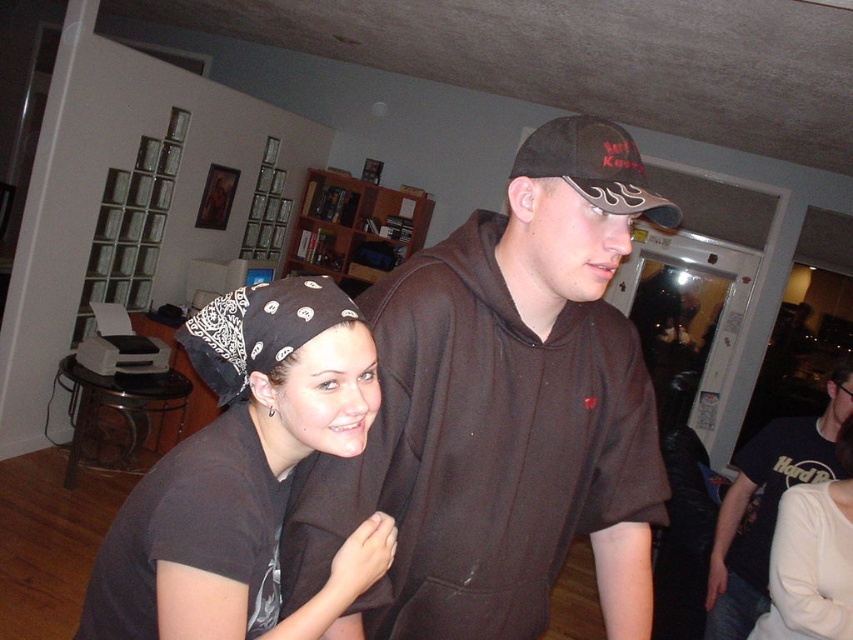
Who is positioned more to the right, black bandana at upper left or black matte baseball cap at upper center?

Positioned to the right is black matte baseball cap at upper center.

Which is above, black bandana at upper left or black matte baseball cap at upper center?

Positioned higher is black matte baseball cap at upper center.

Is point (253, 340) less distant than point (556, 125)?

That is True.

Find the location of `black bandana at upper left`. black bandana at upper left is located at coordinates (259, 330).

Who is taller, black bandana at center or black t-shirt at right?

Standing taller between the two is black t-shirt at right.

Can you confirm if black bandana at center is positioned above black t-shirt at right?

Yes, black bandana at center is above black t-shirt at right.

The image size is (853, 640). I want to click on black bandana at center, so click(244, 476).

Between point (607, 420) and point (236, 365), which one is positioned in front?

Point (236, 365)

Between brown hoodie at center and black bandana at upper left, which one is positioned higher?

black bandana at upper left is above.

Is point (589, 152) farther from viewer compared to point (305, 292)?

Yes, it is behind point (305, 292).

Where is `brown hoodie at center`? brown hoodie at center is located at coordinates tap(502, 413).